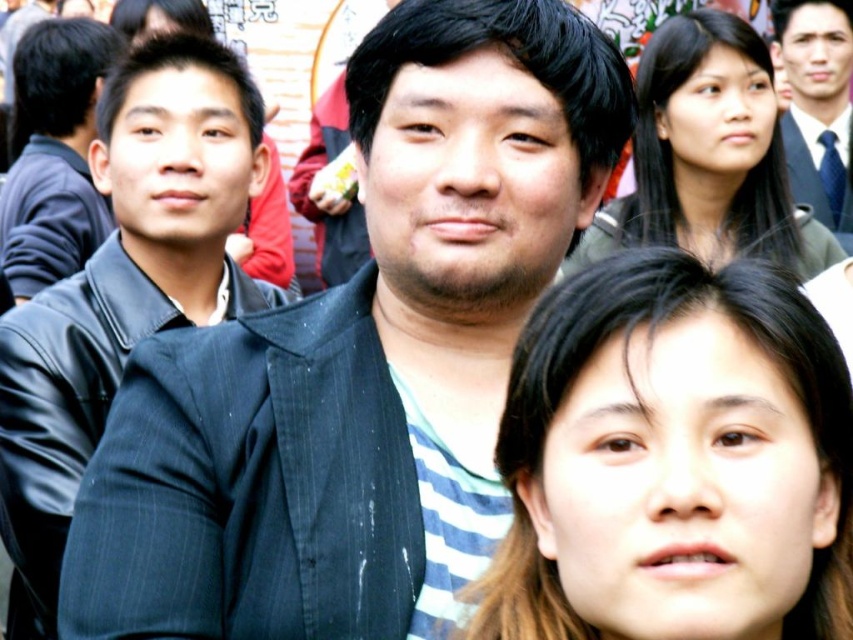
Can you confirm if brown hair at lower center is positioned to the right of smooth black suit at upper right?

No, brown hair at lower center is not to the right of smooth black suit at upper right.

Is point (653, 547) closer to camera compared to point (802, 168)?

Yes, it is.

Identify the location of brown hair at lower center. The height and width of the screenshot is (640, 853). (672, 460).

Between point (570, 458) and point (26, 179), which one is positioned in front?

Positioned in front is point (570, 458).

Does brown hair at lower center come behind matte black jacket at left?

No, it is in front of matte black jacket at left.

This screenshot has width=853, height=640. Find the location of `brown hair at lower center`. brown hair at lower center is located at coordinates (672, 460).

Is matte black jacket at left positioned behind smooth black suit at upper right?

No.

Is matte black jacket at left smaller than smooth black suit at upper right?

Incorrect, matte black jacket at left is not smaller in size than smooth black suit at upper right.

The height and width of the screenshot is (640, 853). I want to click on matte black jacket at left, so click(53, 154).